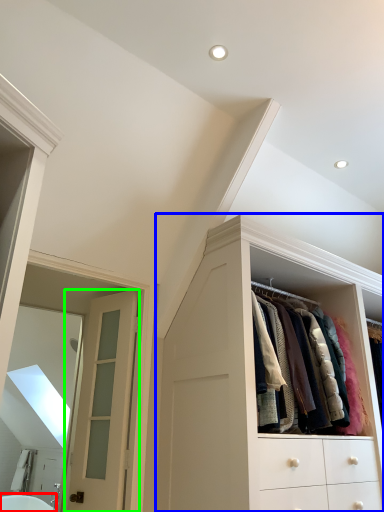
Question: Which object is the closest to the bath (highlighted by a red box)? Choose among these: cabinetry (highlighted by a blue box) or door (highlighted by a green box).

Choices:
 (A) cabinetry
 (B) door

Answer: (B)